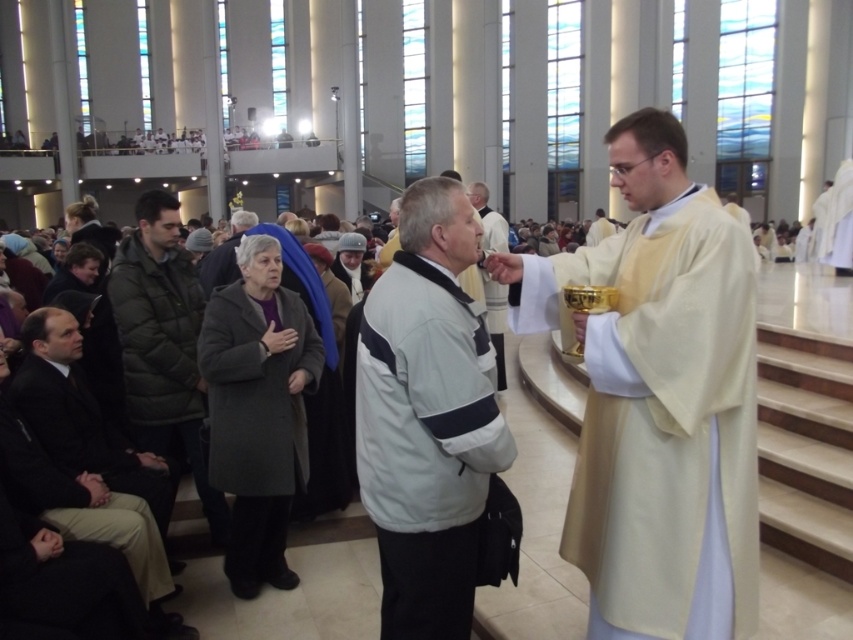
You are standing in the church and want to place a small bouquet of flowers between the two points, point [689,516] and point [495,246]. Which point should the bouquet be closer to in order to be nearer to the elevated platform where the priest is performing the ritual?

The bouquet should be closer to point [689,516] because it is nearer to the elevated platform where the priest is performing the ritual than point [495,246]. Since point [689,516] is closer to the viewer, and the elevated platform is likely positioned at the front of the church where the priest is conducting the ritual, placing the bouquet near this point would position it closer to the platform.